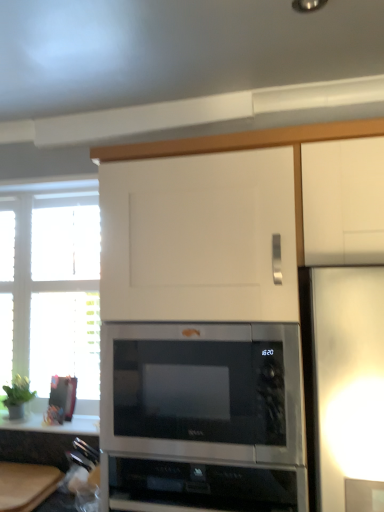
What do you see at coordinates (53, 425) in the screenshot? The image size is (384, 512). I see `white glossy countertop at lower left` at bounding box center [53, 425].

Locate an element on the screen. This screenshot has height=512, width=384. black glass cooktop at lower center is located at coordinates (200, 485).

What do you see at coordinates (202, 390) in the screenshot?
I see `stainless steel microwave at center` at bounding box center [202, 390].

What do you see at coordinates (26, 485) in the screenshot?
I see `wooden cutting board at lower left` at bounding box center [26, 485].

Find the location of `white glossy countertop at lower left`. white glossy countertop at lower left is located at coordinates (53, 425).

Relative to black glass cooktop at lower center, is wooden cutting board at lower left in front or behind?

wooden cutting board at lower left is behind black glass cooktop at lower center.

Considering the relative sizes of wooden cutting board at lower left and black glass cooktop at lower center in the image provided, is wooden cutting board at lower left taller than black glass cooktop at lower center?

Incorrect, the height of wooden cutting board at lower left is not larger of that of black glass cooktop at lower center.

Can you confirm if wooden cutting board at lower left is smaller than black glass cooktop at lower center?

Indeed, wooden cutting board at lower left has a smaller size compared to black glass cooktop at lower center.

How different are the orientations of wooden cutting board at lower left and black glass cooktop at lower center in degrees?

They differ by 0.359 degrees in their facing directions.

What are the coordinates of `window above the white glossy countertop at lower left (from the image's perspective)` in the screenshot? It's located at pos(51,285).

From a real-world perspective, is white wooden window at left below white glossy countertop at lower left?

No, from a real-world perspective, white wooden window at left is not beneath white glossy countertop at lower left.

Looking at this image, which of these two, white wooden window at left or white glossy countertop at lower left, stands shorter?

With less height is white glossy countertop at lower left.

In the scene shown: What's the angular difference between white wooden window at left and white glossy countertop at lower left's facing directions?

white wooden window at left and white glossy countertop at lower left are facing 0.19 degrees away from each other.

From the picture: Between white glossy countertop at lower left and stainless steel microwave at center, which one is positioned behind?

white glossy countertop at lower left.

From the image's perspective, is white glossy countertop at lower left positioned above or below stainless steel microwave at center?

white glossy countertop at lower left is situated lower than stainless steel microwave at center in the image.

Considering the relative sizes of white glossy countertop at lower left and stainless steel microwave at center in the image provided, is white glossy countertop at lower left smaller than stainless steel microwave at center?

Indeed, white glossy countertop at lower left has a smaller size compared to stainless steel microwave at center.

Would you say white glossy countertop at lower left is a long distance from stainless steel microwave at center?

white glossy countertop at lower left is actually quite close to stainless steel microwave at center.

From the picture: In terms of height, does black glass cooktop at lower center look taller or shorter compared to white wooden window at left?

black glass cooktop at lower center is shorter than white wooden window at left.

Does black glass cooktop at lower center appear on the right side of white wooden window at left?

Yes, black glass cooktop at lower center is to the right of white wooden window at left.

Which of these two, black glass cooktop at lower center or white wooden window at left, is wider?

black glass cooktop at lower center is wider.

Is black glass cooktop at lower center oriented towards white wooden window at left?

No, black glass cooktop at lower center is not turned towards white wooden window at left.

I want to click on microwave oven lying in front of the wooden cutting board at lower left, so click(202, 390).

Considering the points (250, 460) and (2, 511), which point is in front, point (250, 460) or point (2, 511)?

The point (250, 460) is in front.

Looking at this image, which object is closer to the camera taking this photo, stainless steel microwave at center or wooden cutting board at lower left?

stainless steel microwave at center is closer to the camera.

From the image's perspective, between stainless steel microwave at center and wooden cutting board at lower left, which one is located above?

stainless steel microwave at center is shown above in the image.

Is white glossy countertop at lower left situated inside wooden cutting board at lower left or outside?

white glossy countertop at lower left is not enclosed by wooden cutting board at lower left.

Is white glossy countertop at lower left closer to camera compared to wooden cutting board at lower left?

That is False.

Which of these two, white glossy countertop at lower left or wooden cutting board at lower left, is wider?

wooden cutting board at lower left.

Find the location of a particular element. table behind the stainless steel microwave at center is located at coordinates (26, 485).

Consider the image. Is wooden cutting board at lower left beside stainless steel microwave at center?

No, wooden cutting board at lower left is not next to stainless steel microwave at center.

Considering the sizes of wooden cutting board at lower left and stainless steel microwave at center in the image, is wooden cutting board at lower left taller or shorter than stainless steel microwave at center?

Clearly, wooden cutting board at lower left is shorter compared to stainless steel microwave at center.

From the image's perspective, would you say wooden cutting board at lower left is positioned over stainless steel microwave at center?

No, from the image's perspective, wooden cutting board at lower left is not over stainless steel microwave at center.

In the image, there is a wooden cutting board at lower left. Where is `appliance above it (from the image's perspective)`? This screenshot has height=512, width=384. appliance above it (from the image's perspective) is located at coordinates (200, 485).

The width and height of the screenshot is (384, 512). In order to click on counter top below the white wooden window at left (from the image's perspective) in this screenshot , I will do `click(53, 425)`.

Which object lies nearer to the anchor point white wooden window at left, stainless steel microwave at center or white glossy countertop at lower left?

white glossy countertop at lower left.

From the image, which object appears to be nearer to wooden cutting board at lower left, white glossy countertop at lower left or white wooden window at left?

Based on the image, white glossy countertop at lower left appears to be nearer to wooden cutting board at lower left.

When comparing their distances from white glossy countertop at lower left, does stainless steel microwave at center or white wooden window at left seem closer?

The object closer to white glossy countertop at lower left is white wooden window at left.

Based on their spatial positions, is wooden cutting board at lower left or stainless steel microwave at center further from white wooden window at left?

Among the two, stainless steel microwave at center is located further to white wooden window at left.

From the image, which object appears to be farther from stainless steel microwave at center, black glass cooktop at lower center or white glossy countertop at lower left?

white glossy countertop at lower left is positioned further to the anchor stainless steel microwave at center.

Estimate the real-world distances between objects in this image. Which object is further from stainless steel microwave at center, black glass cooktop at lower center or white wooden window at left?

white wooden window at left lies further to stainless steel microwave at center than the other object.

Based on their spatial positions, is stainless steel microwave at center or black glass cooktop at lower center further from wooden cutting board at lower left?

The object further to wooden cutting board at lower left is stainless steel microwave at center.

Based on their spatial positions, is white wooden window at left or white glossy countertop at lower left closer to wooden cutting board at lower left?

white glossy countertop at lower left lies closer to wooden cutting board at lower left than the other object.

Locate an element on the screen. The width and height of the screenshot is (384, 512). microwave oven located between black glass cooktop at lower center and white glossy countertop at lower left in the depth direction is located at coordinates [x=202, y=390].

Locate an element on the screen. The image size is (384, 512). counter top between black glass cooktop at lower center and white wooden window at left in the front-back direction is located at coordinates (53, 425).

Locate an element on the screen. The image size is (384, 512). counter top between stainless steel microwave at center and white wooden window at left in the front-back direction is located at coordinates (53, 425).

Locate an element on the screen. Image resolution: width=384 pixels, height=512 pixels. table between black glass cooktop at lower center and white wooden window at left in the front-back direction is located at coordinates (26, 485).